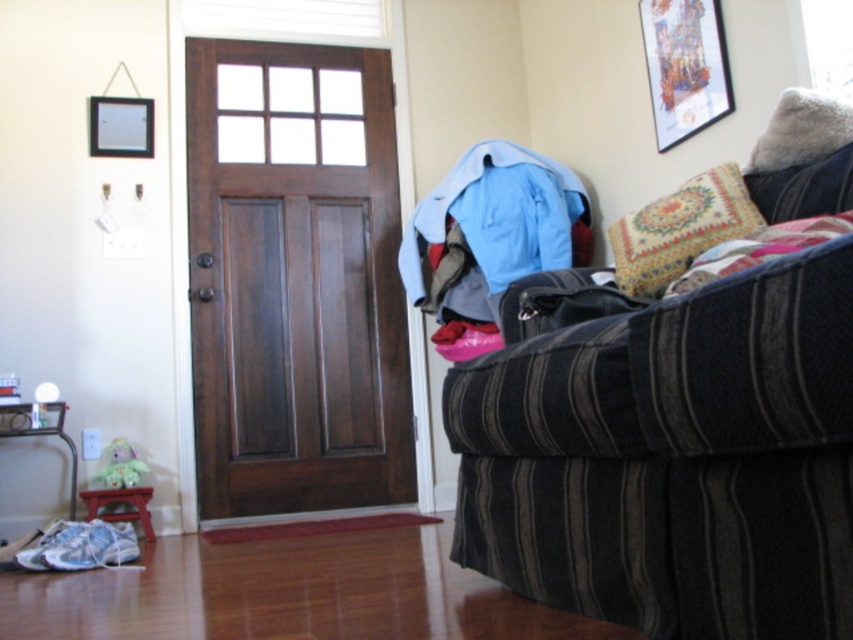
Question: Which point is farther from the camera taking this photo?

Choices:
 (A) (740, 221)
 (B) (531, 182)

Answer: (B)

Question: Which object is closer to the camera taking this photo?

Choices:
 (A) striped fabric couch at right
 (B) wooden picture frame at upper right
 (C) patterned fabric pillow at right

Answer: (A)

Question: Can you confirm if striped fabric couch at right is positioned above dark wood door at center?

Choices:
 (A) yes
 (B) no

Answer: (B)

Question: Which point appears farthest from the camera in this image?

Choices:
 (A) [381, 429]
 (B) [695, 12]
 (C) [477, 296]

Answer: (A)

Question: Is blue fabric at center wider than brushed metal hardwood at lower left?

Choices:
 (A) no
 (B) yes

Answer: (B)

Question: Is blue fabric at center to the left of brushed metal hardwood at lower left from the viewer's perspective?

Choices:
 (A) no
 (B) yes

Answer: (A)